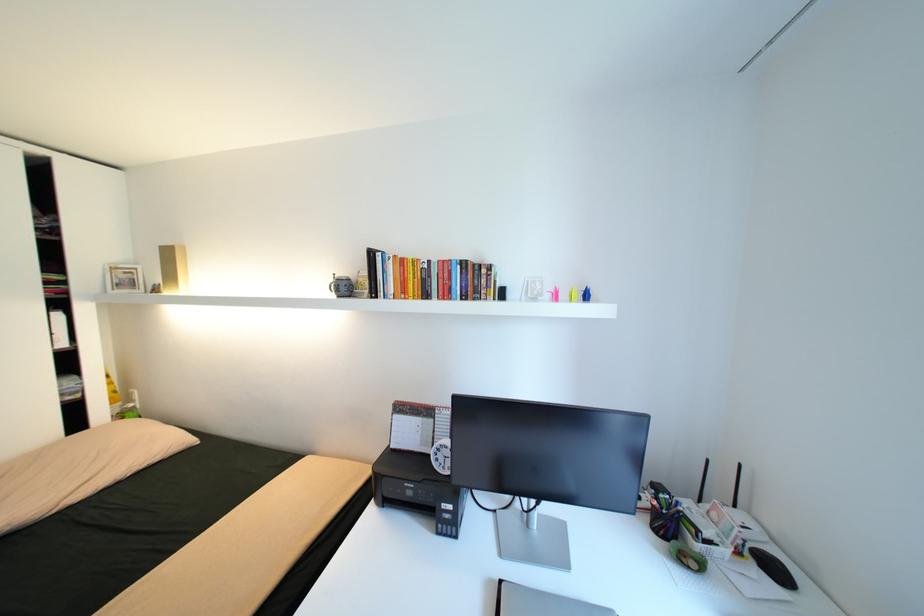
In order to click on black computer mouse in this screenshot , I will do `click(772, 568)`.